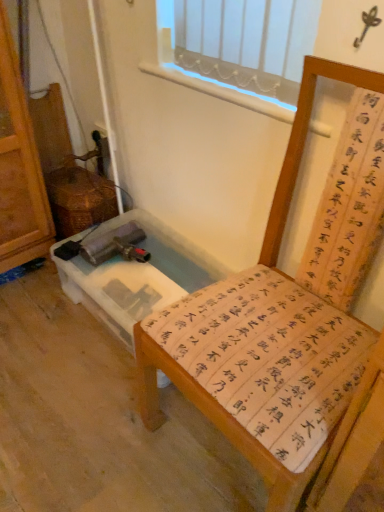
What is the approximate height of clear plastic vanity at lower left?

It is 8.56 inches.

What do you see at coordinates (136, 276) in the screenshot?
I see `clear plastic vanity at lower left` at bounding box center [136, 276].

Where is `clear plastic vanity at lower left`? The image size is (384, 512). clear plastic vanity at lower left is located at coordinates (136, 276).

Identify the location of wooden chair with calligraphy cushion at center. Image resolution: width=384 pixels, height=512 pixels. (216, 422).

What do you see at coordinates (216, 422) in the screenshot? This screenshot has width=384, height=512. I see `wooden chair with calligraphy cushion at center` at bounding box center [216, 422].

I want to click on clear plastic vanity at lower left, so click(x=136, y=276).

Based on the photo, is clear plastic vanity at lower left at the left side of wooden chair with calligraphy cushion at center?

Yes, clear plastic vanity at lower left is to the left of wooden chair with calligraphy cushion at center.

Considering their positions, is clear plastic vanity at lower left located in front of or behind wooden chair with calligraphy cushion at center?

clear plastic vanity at lower left is positioned farther from the viewer than wooden chair with calligraphy cushion at center.

Looking at this image, which is closer, (168, 241) or (379, 76)?

The point (379, 76) is closer.

From the image's perspective, would you say clear plastic vanity at lower left is positioned over wooden chair with calligraphy cushion at center?

Yes.

From a real-world perspective, which object rests below the other?

In real-world perspective, clear plastic vanity at lower left is lower.

Between clear plastic vanity at lower left and wooden chair with calligraphy cushion at center, which one has smaller width?

clear plastic vanity at lower left is thinner.

From the picture: Considering the relative sizes of clear plastic vanity at lower left and wooden chair with calligraphy cushion at center in the image provided, is clear plastic vanity at lower left taller than wooden chair with calligraphy cushion at center?

In fact, clear plastic vanity at lower left may be shorter than wooden chair with calligraphy cushion at center.

Can you confirm if clear plastic vanity at lower left is bigger than wooden chair with calligraphy cushion at center?

No.

Would you say wooden chair with calligraphy cushion at center is part of clear plastic vanity at lower left's contents?

No, wooden chair with calligraphy cushion at center is not inside clear plastic vanity at lower left.

Is clear plastic vanity at lower left not near wooden chair with calligraphy cushion at center?

No, clear plastic vanity at lower left is not far from wooden chair with calligraphy cushion at center.

Is clear plastic vanity at lower left facing towards wooden chair with calligraphy cushion at center?

No.

What's the angular difference between clear plastic vanity at lower left and wooden chair with calligraphy cushion at center's facing directions?

The facing directions of clear plastic vanity at lower left and wooden chair with calligraphy cushion at center are 0.593 degrees apart.

Could you measure the distance between clear plastic vanity at lower left and wooden chair with calligraphy cushion at center?

clear plastic vanity at lower left and wooden chair with calligraphy cushion at center are 51.42 centimeters apart.

The height and width of the screenshot is (512, 384). In order to click on furniture that appears on the right of clear plastic vanity at lower left in this screenshot , I will do `click(216, 422)`.

Considering the positions of objects wooden chair with calligraphy cushion at center and clear plastic vanity at lower left in the image provided, who is more to the left, wooden chair with calligraphy cushion at center or clear plastic vanity at lower left?

clear plastic vanity at lower left.

Which object is closer to the camera, wooden chair with calligraphy cushion at center or clear plastic vanity at lower left?

wooden chair with calligraphy cushion at center is closer to the camera.

Does point (197, 399) lie behind point (153, 298)?

No, (197, 399) is in front of (153, 298).

From the image's perspective, is wooden chair with calligraphy cushion at center above or below clear plastic vanity at lower left?

From the image's perspective, wooden chair with calligraphy cushion at center appears below clear plastic vanity at lower left.

From a real-world perspective, between wooden chair with calligraphy cushion at center and clear plastic vanity at lower left, who is vertically lower?

In real-world perspective, clear plastic vanity at lower left is lower.

Considering the relative sizes of wooden chair with calligraphy cushion at center and clear plastic vanity at lower left in the image provided, is wooden chair with calligraphy cushion at center thinner than clear plastic vanity at lower left?

No, wooden chair with calligraphy cushion at center is not thinner than clear plastic vanity at lower left.

From their relative heights in the image, would you say wooden chair with calligraphy cushion at center is taller or shorter than clear plastic vanity at lower left?

wooden chair with calligraphy cushion at center is taller than clear plastic vanity at lower left.

Between wooden chair with calligraphy cushion at center and clear plastic vanity at lower left, which one has larger size?

wooden chair with calligraphy cushion at center.

Could clear plastic vanity at lower left be considered to be inside wooden chair with calligraphy cushion at center?

No, clear plastic vanity at lower left is not inside wooden chair with calligraphy cushion at center.

Is wooden chair with calligraphy cushion at center next to clear plastic vanity at lower left and touching it?

No, wooden chair with calligraphy cushion at center is not touching clear plastic vanity at lower left.

Is wooden chair with calligraphy cushion at center oriented away from clear plastic vanity at lower left?

No, wooden chair with calligraphy cushion at center is not facing away from clear plastic vanity at lower left.

What's the angular difference between wooden chair with calligraphy cushion at center and clear plastic vanity at lower left's facing directions?

They differ by 0.593 degrees in their facing directions.

How much distance is there between wooden chair with calligraphy cushion at center and clear plastic vanity at lower left?

wooden chair with calligraphy cushion at center and clear plastic vanity at lower left are 20.25 inches apart from each other.

Identify the location of vanity below the wooden chair with calligraphy cushion at center (from a real-world perspective). This screenshot has height=512, width=384. (136, 276).

Locate an element on the screen. The width and height of the screenshot is (384, 512). vanity behind the wooden chair with calligraphy cushion at center is located at coordinates (136, 276).

Where is `furniture that is on the right side of clear plastic vanity at lower left`? The image size is (384, 512). furniture that is on the right side of clear plastic vanity at lower left is located at coordinates (216, 422).